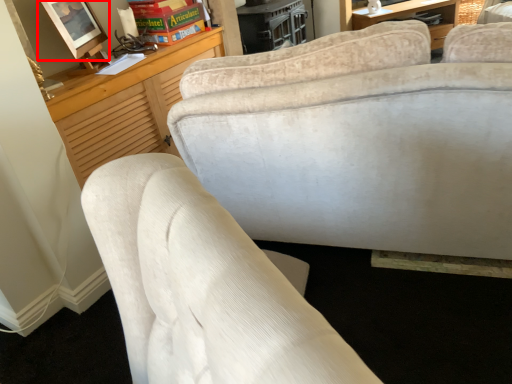
Question: From the image, what is the correct spatial relationship of picture frame (annotated by the red box) in relation to book?

Choices:
 (A) right
 (B) left

Answer: (B)